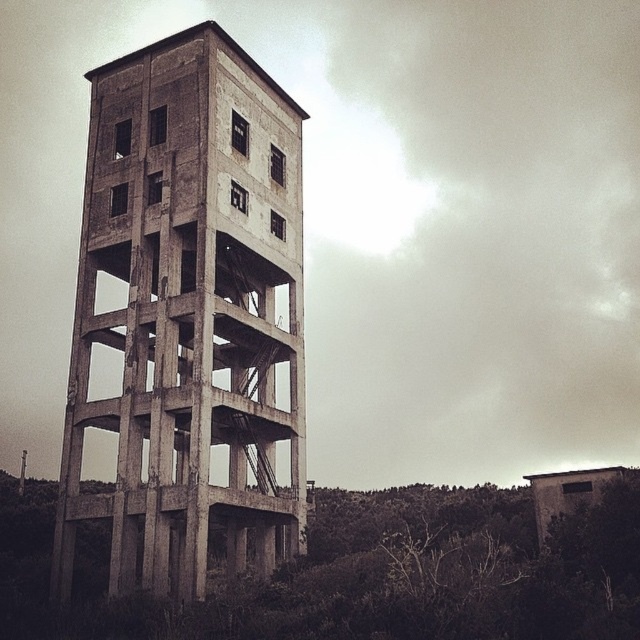
What do you see at coordinates (188, 310) in the screenshot?
I see `concrete tower at center` at bounding box center [188, 310].

Can you confirm if concrete tower at center is thinner than concrete structure at center?

Yes, concrete tower at center is thinner than concrete structure at center.

Which is in front, point (141, 180) or point (614, 534)?

Point (614, 534) is more forward.

You are a GUI agent. You are given a task and a screenshot of the screen. Output one action in this format:
    pyautogui.click(x=<x>, y=<y>)
    Task: Click on the concrete tower at center
    
    Given the screenshot: What is the action you would take?
    pyautogui.click(x=188, y=310)